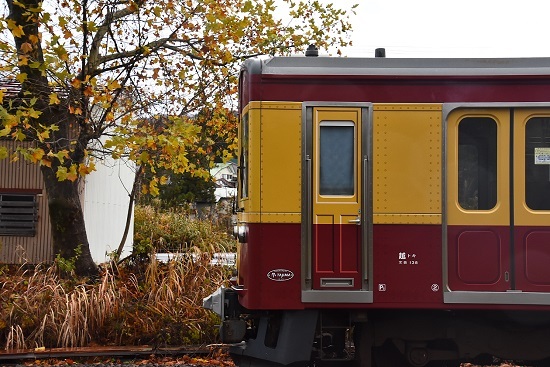
Image resolution: width=550 pixels, height=367 pixels. Find the location of `lights`. lights is located at coordinates (236, 232).